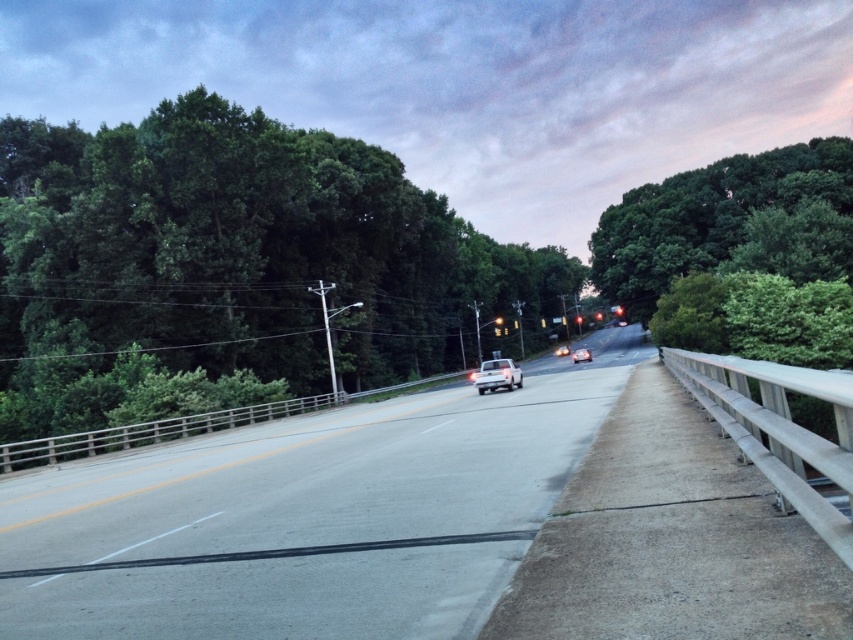
Measure the distance between green leafy tree at left and camera.

The distance of green leafy tree at left from camera is 67.31 feet.

Can you confirm if green leafy tree at left is bigger than white matte truck at center?

Indeed, green leafy tree at left has a larger size compared to white matte truck at center.

Does point (123, 412) lie behind point (563, 349)?

No, it is in front of (563, 349).

Locate an element on the screen. Image resolution: width=853 pixels, height=640 pixels. green leafy tree at left is located at coordinates (236, 269).

Is gray asphalt highway at center shorter than white matte car at center?

Yes.

How far apart are gray asphalt highway at center and white matte car at center?

gray asphalt highway at center and white matte car at center are 42.03 feet apart.

Does point (613, 352) come closer to viewer compared to point (492, 372)?

No, (613, 352) is behind (492, 372).

The width and height of the screenshot is (853, 640). What are the coordinates of `gray asphalt highway at center` in the screenshot? It's located at (308, 516).

Who is taller, gray asphalt highway at center or white matte truck at center?

With more height is gray asphalt highway at center.

Which is in front, point (584, 394) or point (567, 349)?

Point (584, 394)

Identify the location of gray asphalt highway at center. pyautogui.click(x=308, y=516).